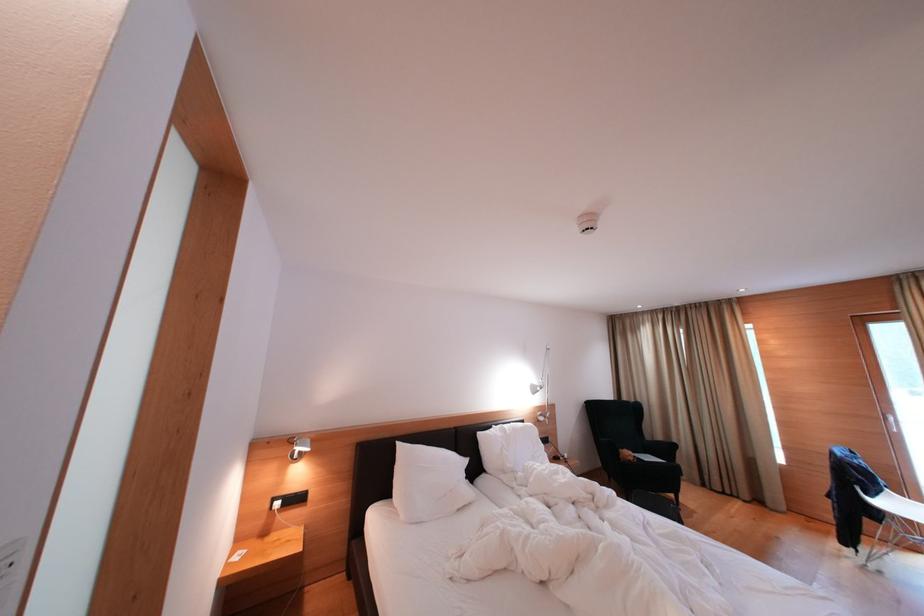
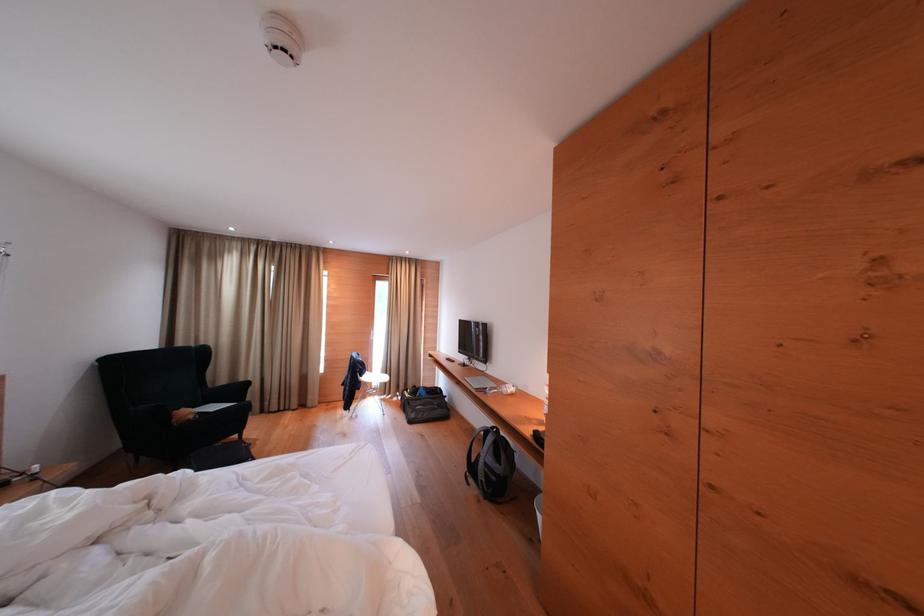
The point at (673,454) is marked in the first image. Where is the corresponding point in the second image?

(244, 394)